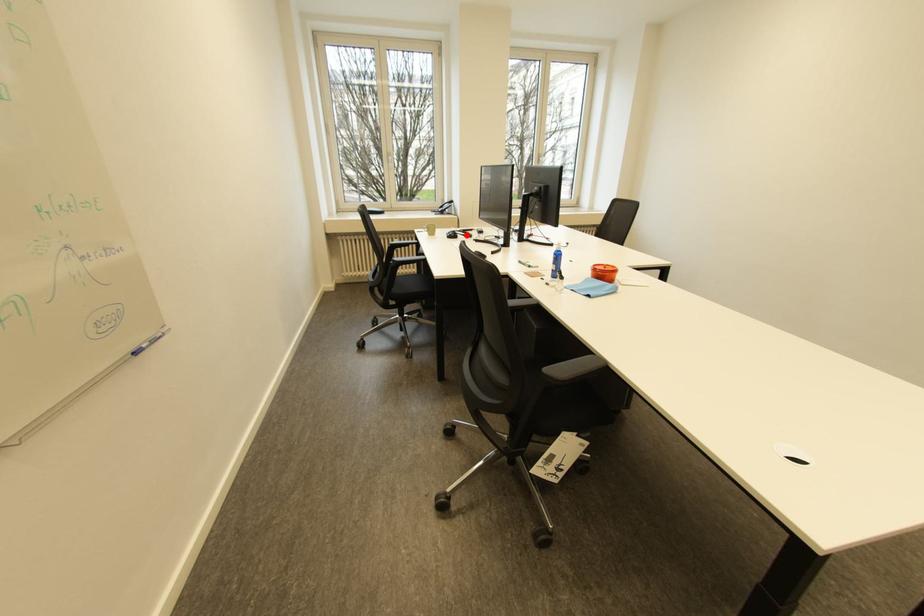
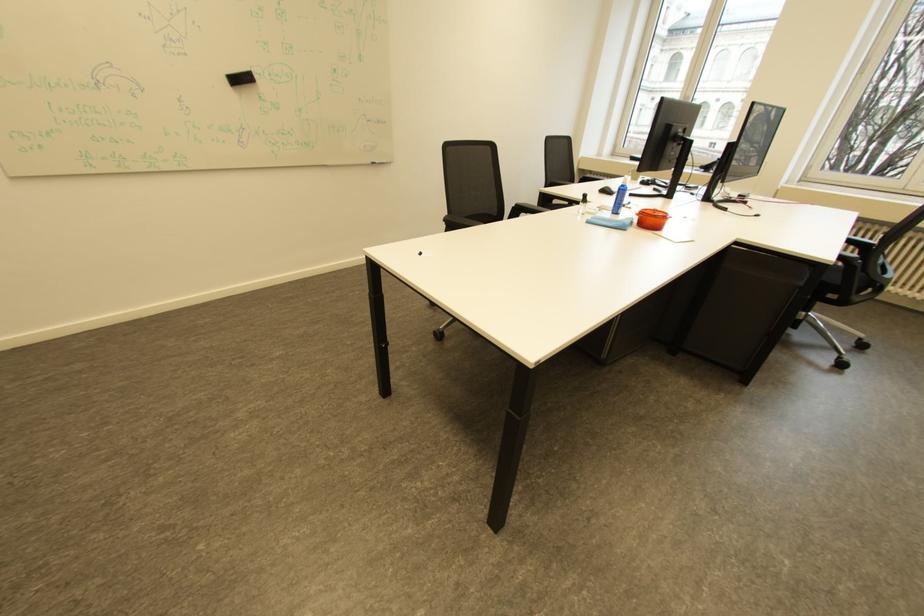
Question: I am providing you with two images of the same scene from different viewpoints. A red point is marked on the first image. Is the red point's position out of view in image 2?

Choices:
 (A) Yes
 (B) No

Answer: (A)